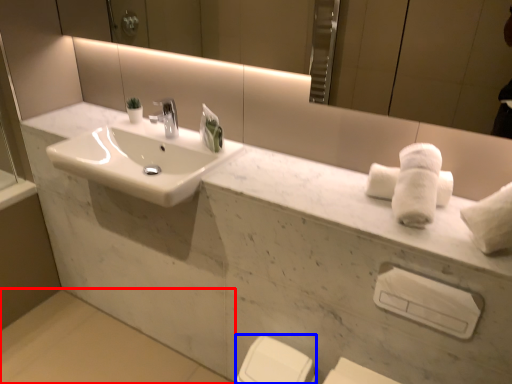
Question: Among these objects, which one is nearest to the camera, concrete (highlighted by a red box) or porcelain (highlighted by a blue box)?

Choices:
 (A) concrete
 (B) porcelain

Answer: (B)